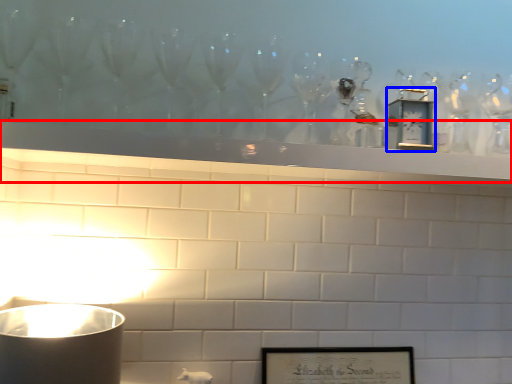
Question: Among these objects, which one is nearest to the camera, mantle (highlighted by a red box) or clock (highlighted by a blue box)?

Choices:
 (A) mantle
 (B) clock

Answer: (A)